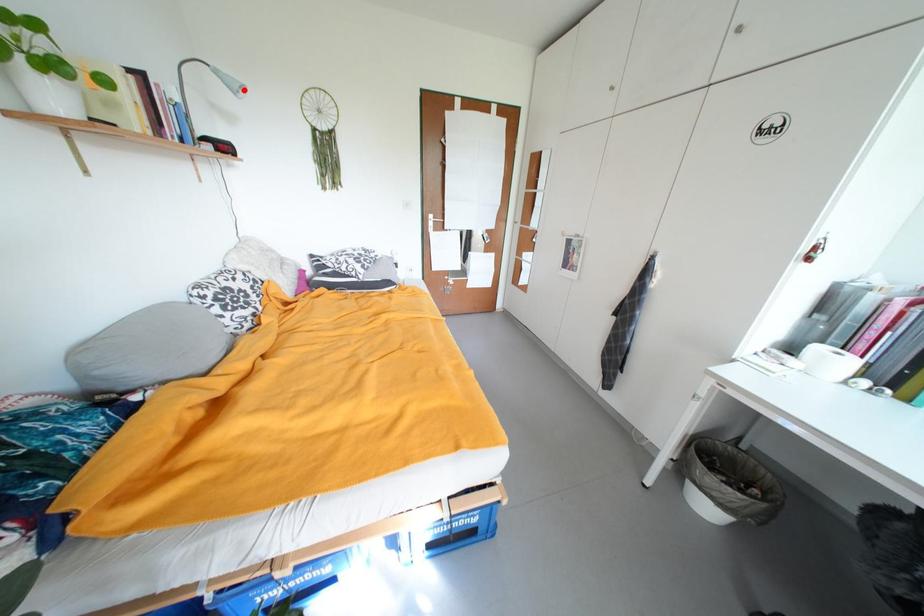
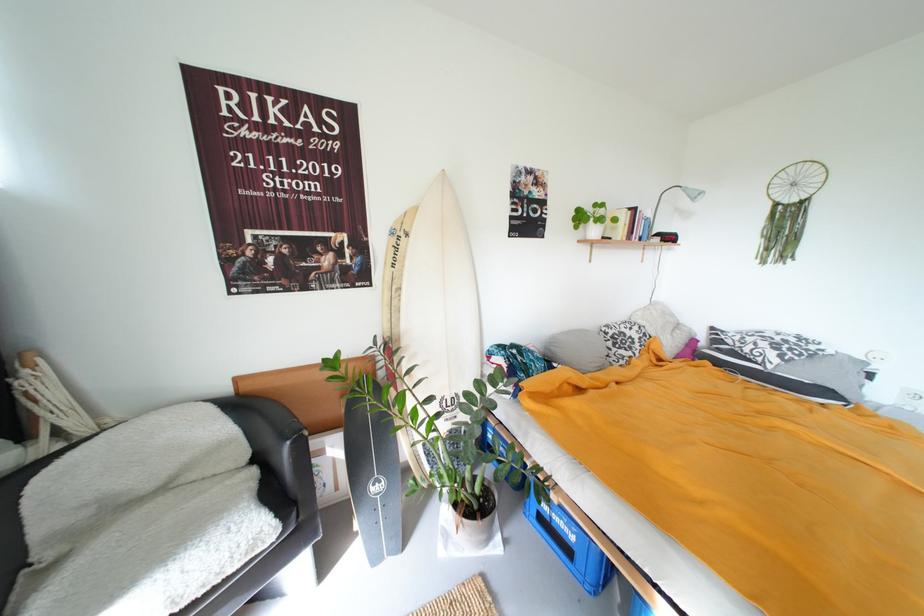
Find the pixel in the second image that matches the highlighted location in the first image.

(703, 198)